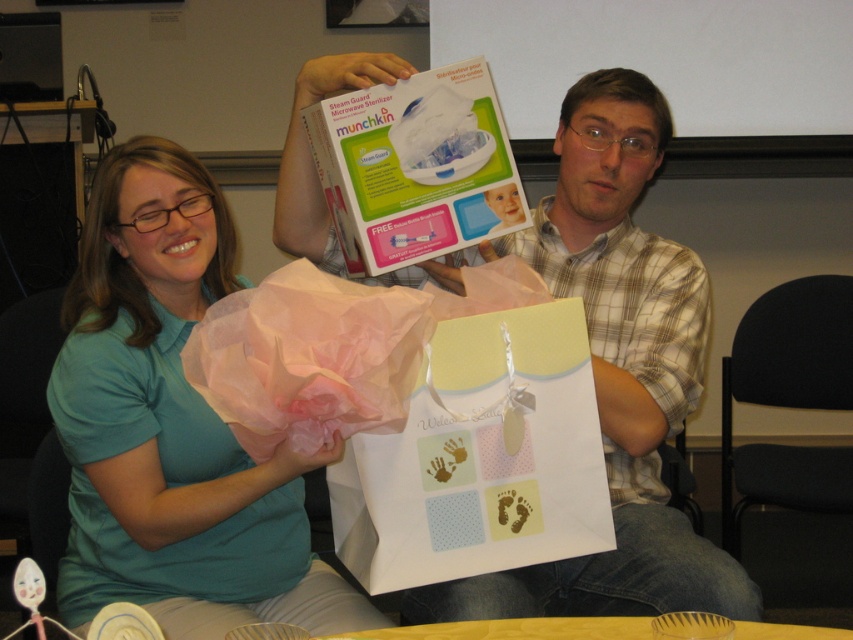
Question: Is teal fabric shirt at center below plaid shirt at center?

Choices:
 (A) yes
 (B) no

Answer: (A)

Question: Does teal fabric shirt at center appear on the right side of plaid shirt at center?

Choices:
 (A) no
 (B) yes

Answer: (A)

Question: Can you confirm if teal fabric shirt at center is smaller than plaid shirt at center?

Choices:
 (A) no
 (B) yes

Answer: (B)

Question: Which point is farther from the camera taking this photo?

Choices:
 (A) (706, 316)
 (B) (258, 604)

Answer: (A)

Question: Among these points, which one is farthest from the camera?

Choices:
 (A) (183, 237)
 (B) (606, 609)

Answer: (B)